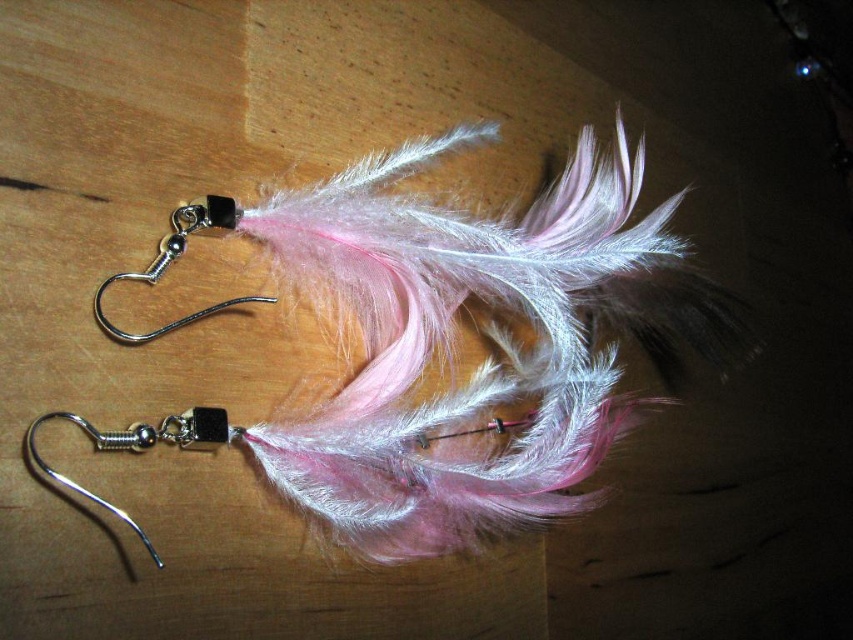
Based on the photo, you are a photographer adjusting the focus on your camera. You notice two points in the image labeled as point (51,476) and point (209,307). Which point should you focus on first if you want to ensure the closest object is in sharp focus?

You should focus on point (51,476) first because it is closer to the camera than point (209,307), ensuring the closest object is in sharp focus.